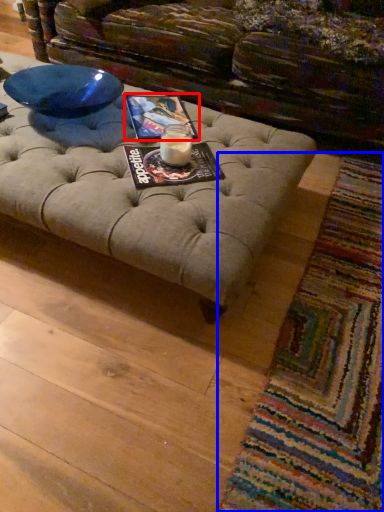
Question: Which of the following is the farthest to the observer, magazine (highlighted by a red box) or mat (highlighted by a blue box)?

Choices:
 (A) magazine
 (B) mat

Answer: (A)